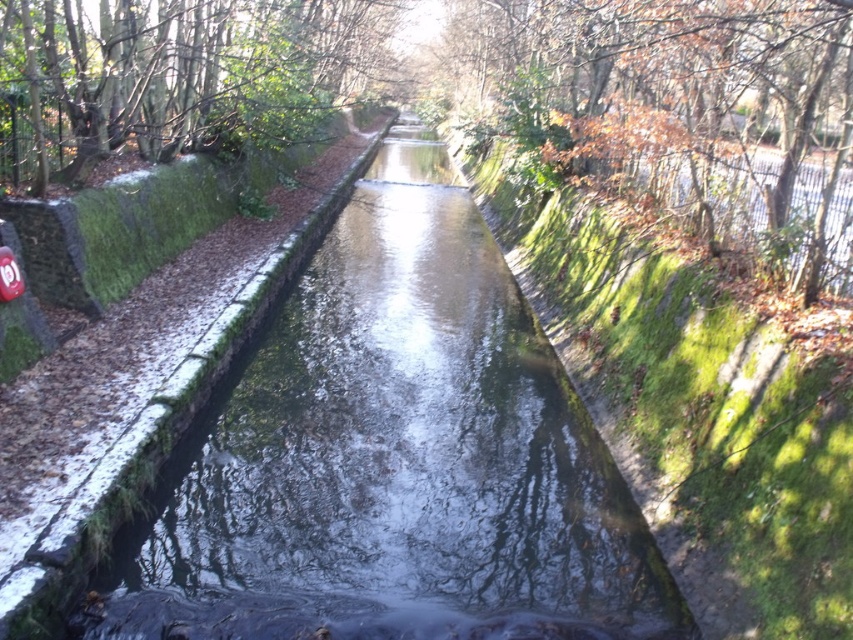
Question: Among these points, which one is nearest to the camera?

Choices:
 (A) (167, 26)
 (B) (239, 545)

Answer: (B)

Question: Is green mossy stream at center further to the viewer compared to brown leafy tree at upper right?

Choices:
 (A) yes
 (B) no

Answer: (B)

Question: Is brown leafy tree at upper right bigger than green mossy tree at upper left?

Choices:
 (A) yes
 (B) no

Answer: (B)

Question: Does brown leafy tree at upper right have a lesser width compared to green mossy tree at upper left?

Choices:
 (A) yes
 (B) no

Answer: (A)

Question: Which point is closer to the camera taking this photo?

Choices:
 (A) (821, 29)
 (B) (166, 16)
 (C) (474, 336)

Answer: (A)

Question: Which point is closer to the camera taking this photo?

Choices:
 (A) (408, 340)
 (B) (773, 211)

Answer: (B)